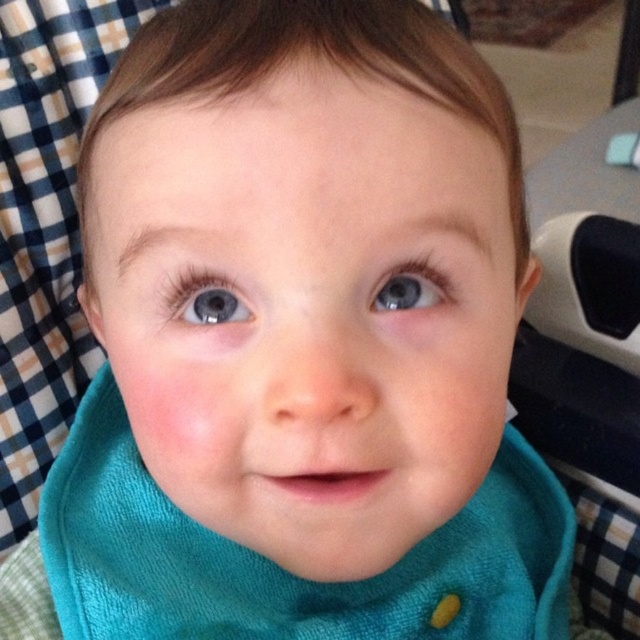
Is teal soft fabric bib at center bigger than blue glossy eye at upper center?

Yes.

Can you confirm if teal soft fabric bib at center is smaller than blue glossy eye at upper center?

No, teal soft fabric bib at center is not smaller than blue glossy eye at upper center.

The height and width of the screenshot is (640, 640). What are the coordinates of `teal soft fabric bib at center` in the screenshot? It's located at (284, 570).

Where is `blue glossy eye at center`? The height and width of the screenshot is (640, 640). blue glossy eye at center is located at coordinates (205, 300).

Between blue glossy eye at center and blue glossy eye at upper center, which one has more height?

blue glossy eye at center is taller.

Which is behind, point (212, 300) or point (416, 298)?

The point (416, 298) is more distant.

I want to click on blue glossy eye at center, so click(205, 300).

Does teal soft fabric bib at center have a greater width compared to blue glossy eye at center?

Yes.

Is teal soft fabric bib at center smaller than blue glossy eye at center?

Actually, teal soft fabric bib at center might be larger than blue glossy eye at center.

This screenshot has width=640, height=640. Identify the location of teal soft fabric bib at center. (284, 570).

Identify the location of teal soft fabric bib at center. The image size is (640, 640). (284, 570).